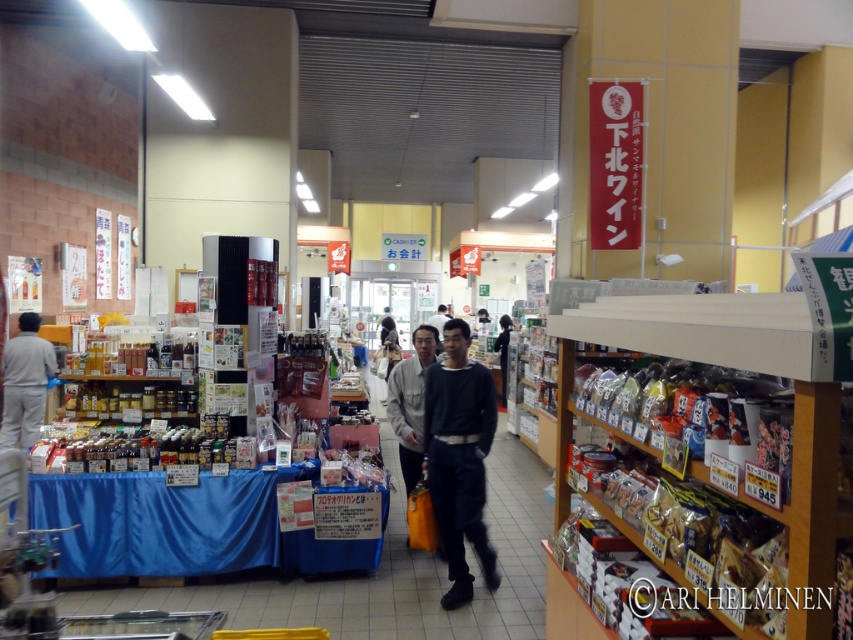
You are a customer in the store and see the dark blue sweater at center and the dark gray sweater at center. Which one is nearer to you?

The dark blue sweater at center is closer to the viewer than the dark gray sweater at center, so the dark blue sweater at center is nearer to you.